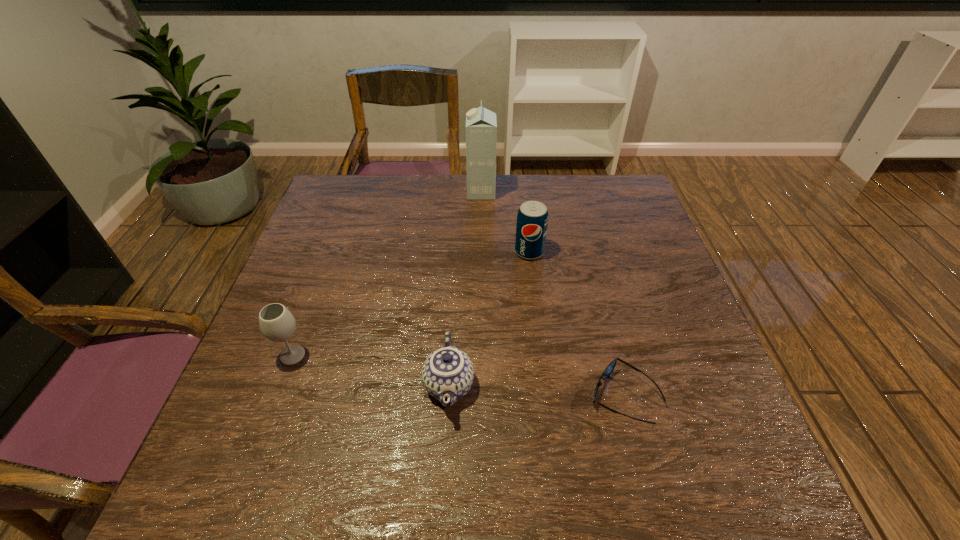
You are a GUI agent. You are given a task and a screenshot of the screen. Output one action in this format:
    pyautogui.click(x=<x>, y=<y>)
    Task: Click on the empty space that is in between the second shortest object and the tallest object
    
    Given the screenshot: What is the action you would take?
    pyautogui.click(x=465, y=289)

Where is `free space between the fourth object from left to right and the rightmost object`? The height and width of the screenshot is (540, 960). free space between the fourth object from left to right and the rightmost object is located at coordinates (576, 324).

Locate an element on the screen. The height and width of the screenshot is (540, 960). free space between the chinaware and the farthest object is located at coordinates (465, 289).

The image size is (960, 540). Find the location of `free space between the pop and the tallest object`. free space between the pop and the tallest object is located at coordinates [505, 222].

Locate an element on the screen. This screenshot has width=960, height=540. vacant area between the leftmost object and the fourth object from left to right is located at coordinates (411, 303).

At what (x,y) coordinates should I click in order to perform the action: click on vacant point located between the leftmost object and the farthest object. Please return your answer as a coordinate pair (x, y). Looking at the image, I should click on (387, 274).

Find the location of a particular element. object identified as the second closest to the rightmost object is located at coordinates (532, 220).

Locate an element on the screen. The width and height of the screenshot is (960, 540). the third closest object to the carton is located at coordinates (611, 366).

Image resolution: width=960 pixels, height=540 pixels. Identify the location of free point that satisfies the following two spatial constraints: 1. on the front label of the fourth object from left to right; 2. on the left side of the farthest object. (481, 252).

Locate an element on the screen. The width and height of the screenshot is (960, 540). free point that satisfies the following two spatial constraints: 1. on the back side of the second object from right to left; 2. on the front label of the tallest object is located at coordinates (522, 192).